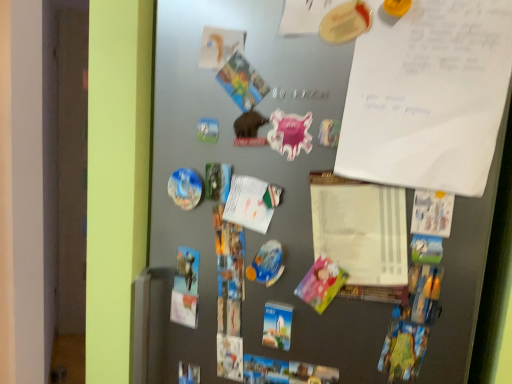
Question: From a real-world perspective, is white paper at center positioned above or below glossy plastic magnet at center-left, which is the first art from left to right?

Choices:
 (A) above
 (B) below

Answer: (B)

Question: From their relative heights in the image, would you say white paper at center is taller or shorter than glossy plastic magnet at center-left, which appears as the 2th art when viewed from the right?

Choices:
 (A) tall
 (B) short

Answer: (A)

Question: Which of these objects is positioned farthest from the metallic gray fridge at center?

Choices:
 (A) pink paper postcard at center-right
 (B) glossy plastic magnet at center-left, which is counted as the first art, starting from the bottom
 (C) white paper at center
 (D) pink glossy magnet at center, which is counted as the 1th art, starting from the front
 (E) white paper at upper right

Answer: (A)

Question: Which of these objects is positioned farthest from the pink glossy magnet at center, marked as the 1th art in a top-to-bottom arrangement?

Choices:
 (A) glossy plastic magnet at center-left, which is the first art from left to right
 (B) white paper at upper right
 (C) pink paper postcard at center-right
 (D) white paper at center
 (E) metallic gray fridge at center

Answer: (E)